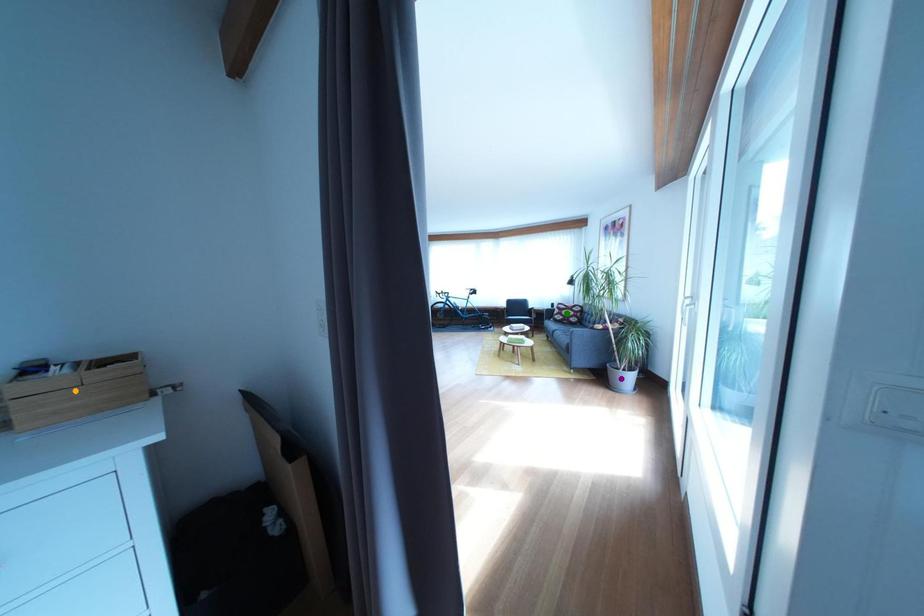
Order these from farthest to nearest:
1. green point
2. purple point
3. orange point

green point → purple point → orange point